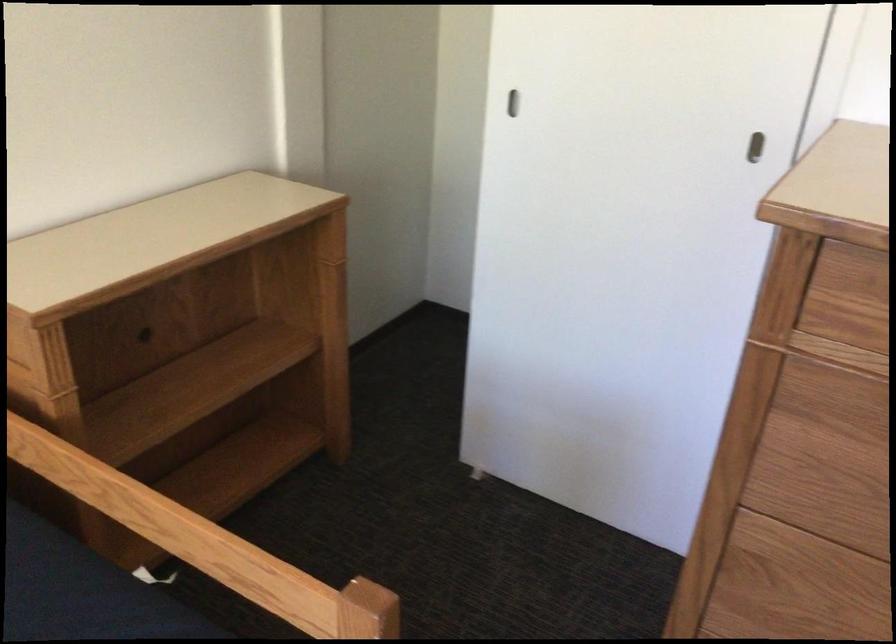
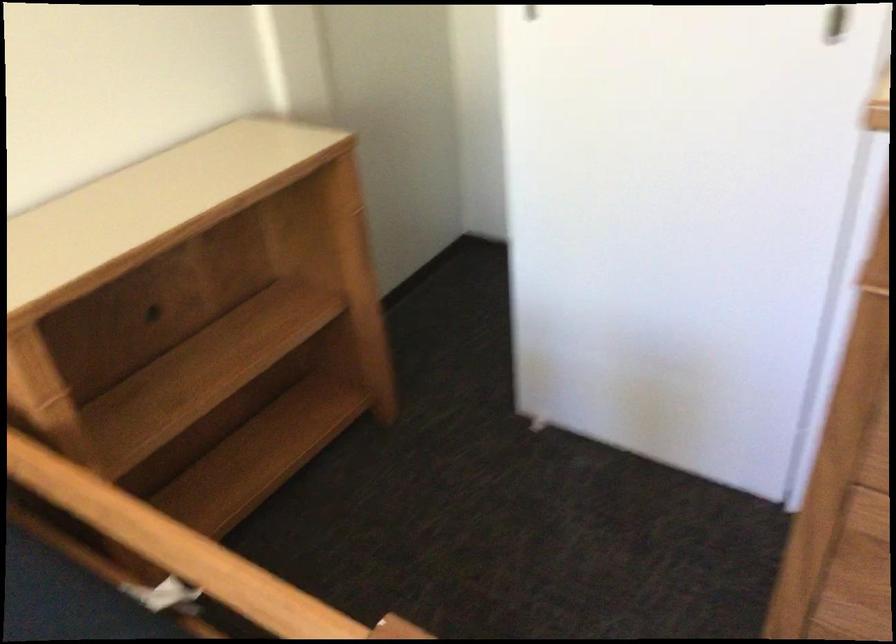
Question: Based on the continuous images, in which direction is the camera rotating? Reply with the corresponding letter.

Choices:
 (A) Left
 (B) Right
 (C) Up
 (D) Down

Answer: (D)